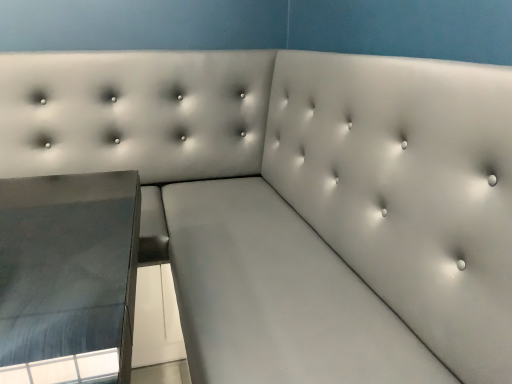
This screenshot has width=512, height=384. Describe the element at coordinates (68, 277) in the screenshot. I see `shiny metallic table at left` at that location.

This screenshot has width=512, height=384. What are the coordinates of `shiny metallic table at left` in the screenshot? It's located at (68, 277).

The width and height of the screenshot is (512, 384). I want to click on shiny metallic table at left, so click(68, 277).